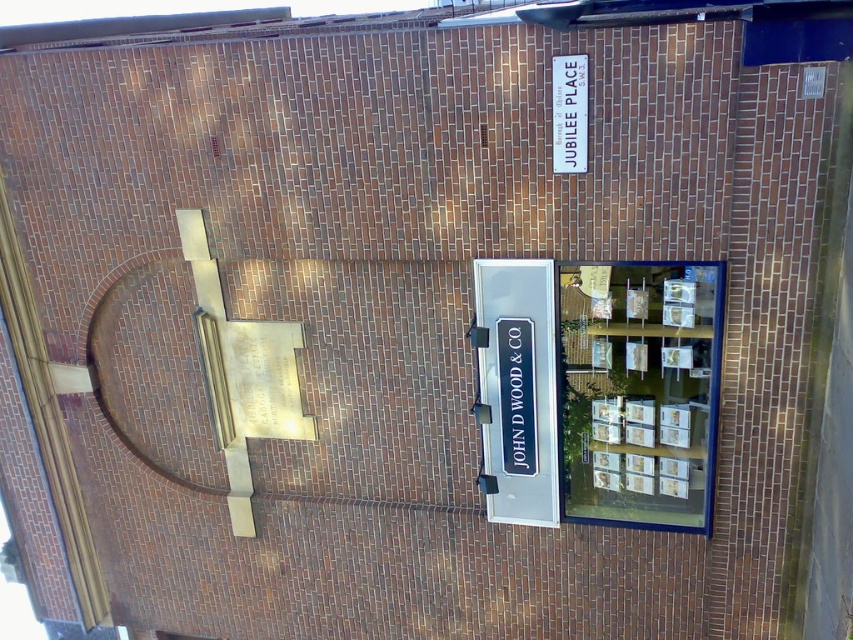
Does black plastic sign at center appear on the left side of white plastic sign at upper center?

Correct, you'll find black plastic sign at center to the left of white plastic sign at upper center.

Who is more forward, (529,376) or (550,124)?

Point (550,124) is more forward.

Locate an element on the screen. The width and height of the screenshot is (853, 640). black plastic sign at center is located at coordinates (515, 396).